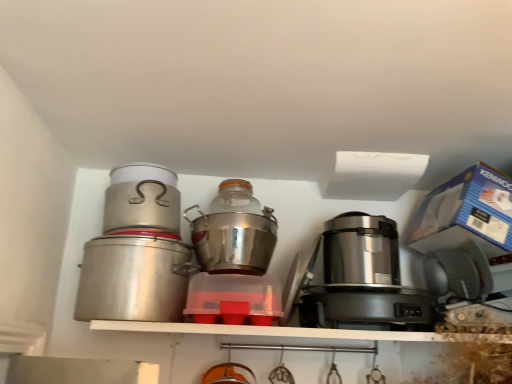
Question: From a real-world perspective, is shiny metallic pot at center, the 4th kitchen appliance from the left, above or below transparent plastic container at center, positioned as the second kitchen appliance in right-to-left order?

Choices:
 (A) above
 (B) below

Answer: (A)

Question: From the image's perspective, is shiny metallic pot at center, which is the 1th kitchen appliance in right-to-left order, positioned above or below transparent plastic container at center, positioned as the second kitchen appliance in right-to-left order?

Choices:
 (A) below
 (B) above

Answer: (B)

Question: Which is nearer to the satin metallic rice cooker at center, which ranks as the 2th appliance in bottom-to-top order?

Choices:
 (A) transparent plastic container at center, positioned as the second kitchen appliance in right-to-left order
 (B) satin silver appliance at right, the first appliance positioned from the bottom
 (C) brushed metal canister at left, which is the second kitchen appliance from left to right
 (D) brushed metal canister at left, the 4th kitchen appliance positioned from the right
 (E) shiny metallic pot at center, the 4th kitchen appliance from the left

Answer: (B)

Question: Which object is the closest to the brushed metal canister at left, which is the second kitchen appliance from left to right?

Choices:
 (A) satin metallic rice cooker at center, which ranks as the 2th appliance in bottom-to-top order
 (B) satin silver appliance at right, the first appliance positioned from the bottom
 (C) transparent plastic container at center, the 3th kitchen appliance when ordered from left to right
 (D) shiny metallic pot at center, the 4th kitchen appliance from the left
 (E) brushed metal canister at left, marked as the first kitchen appliance in a left-to-right arrangement

Answer: (E)